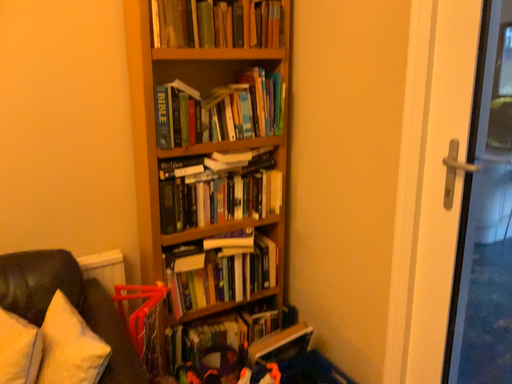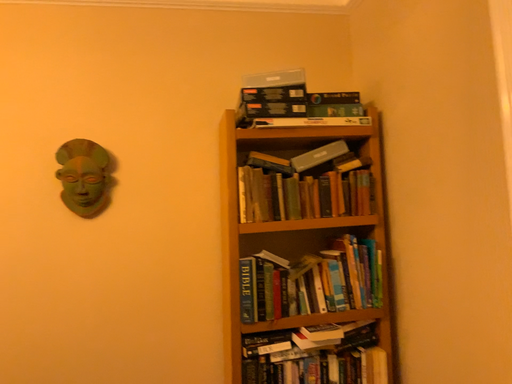
Question: Which way did the camera rotate in the video?

Choices:
 (A) rotated right
 (B) rotated left

Answer: (B)